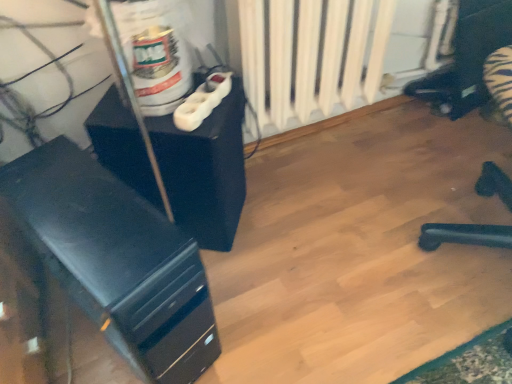
This screenshot has width=512, height=384. I want to click on free point in front of matte black cabinet at center-left, placed as the first furniture when sorted from top to bottom, so click(x=232, y=299).